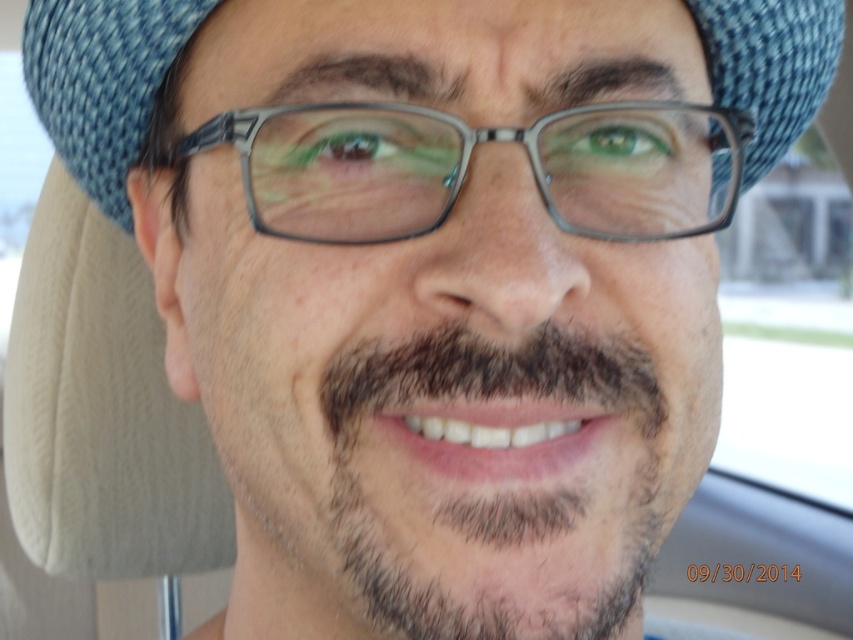
You are a photographer trying to focus on the blue textured hat at center while taking a portrait. However, the clear plastic glasses at center are blocking your view. Can you adjust your angle to capture the hat without the glasses obstructing it?

The clear plastic glasses at center are in front of the blue textured hat at center, so adjusting the angle might not remove the obstruction since the glasses are closer to the camera. You may need to physically move the glasses or reposition the subject to ensure the hat is visible without obstruction.

Based on the photo, you are a photographer adjusting the focus of your camera. You want to capture both the clear plastic glasses at center and the blue textured hat at center in sharp detail. Given that your camera can focus clearly on objects within a 2 inch range, will both items be in focus?

The clear plastic glasses at center is 2.26 inches from the blue textured hat at center. Since the distance between them exceeds the camera focus range of 2 inches, both items cannot be in focus simultaneously.

You are a photographer trying to capture a closeup of the blue textured hat at center while ensuring the dark brown fuzzy beard at center is still visible. Can you adjust your camera angle to focus on the hat without completely hiding the beard?

The dark brown fuzzy beard at center is positioned under the blue textured hat at center, so adjusting the camera angle to focus on the hat while tilting slightly upward might keep the beard visible.